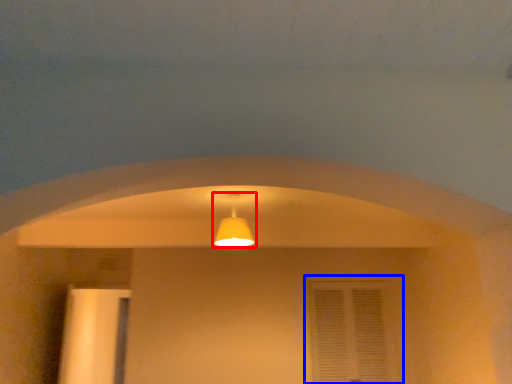
Question: Among these objects, which one is farthest to the camera, lamp (highlighted by a red box) or window (highlighted by a blue box)?

Choices:
 (A) lamp
 (B) window

Answer: (B)